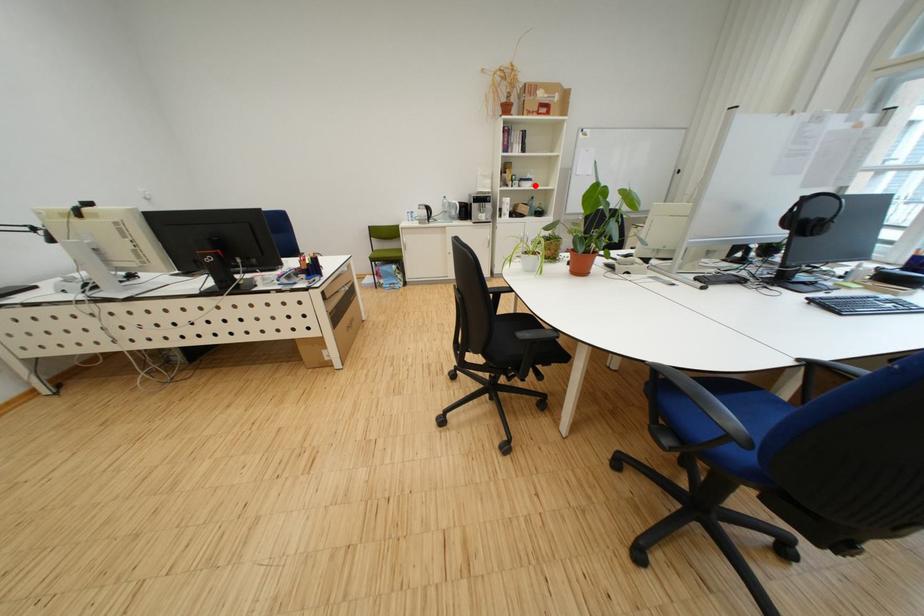
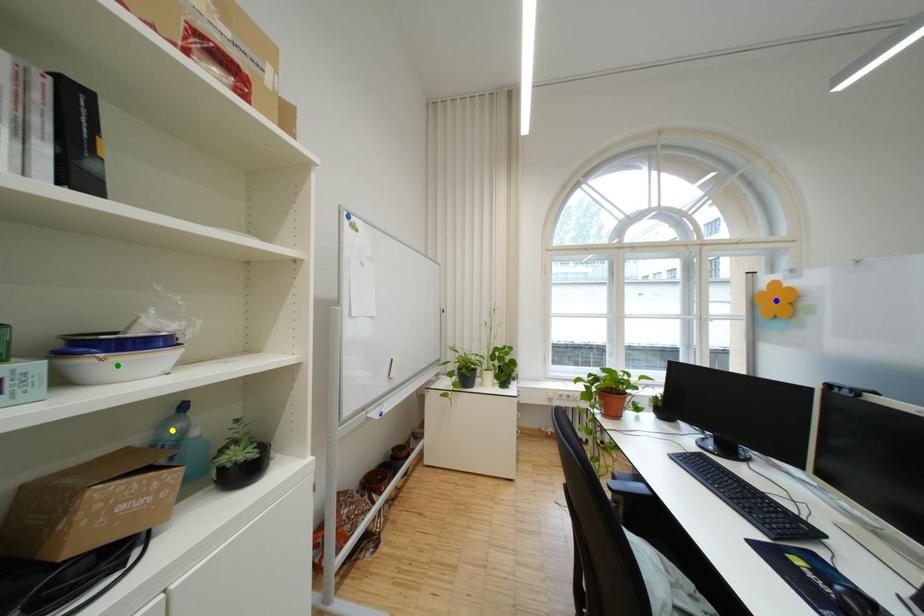
Question: I am providing you with two images of the same scene from different viewpoints. A red point is marked on the first image. You are given multiple points on the second image. Which point in image 2 represents the same 3d spot as the red point in image 1?

Choices:
 (A) blue point
 (B) green point
 (C) yellow point

Answer: (B)